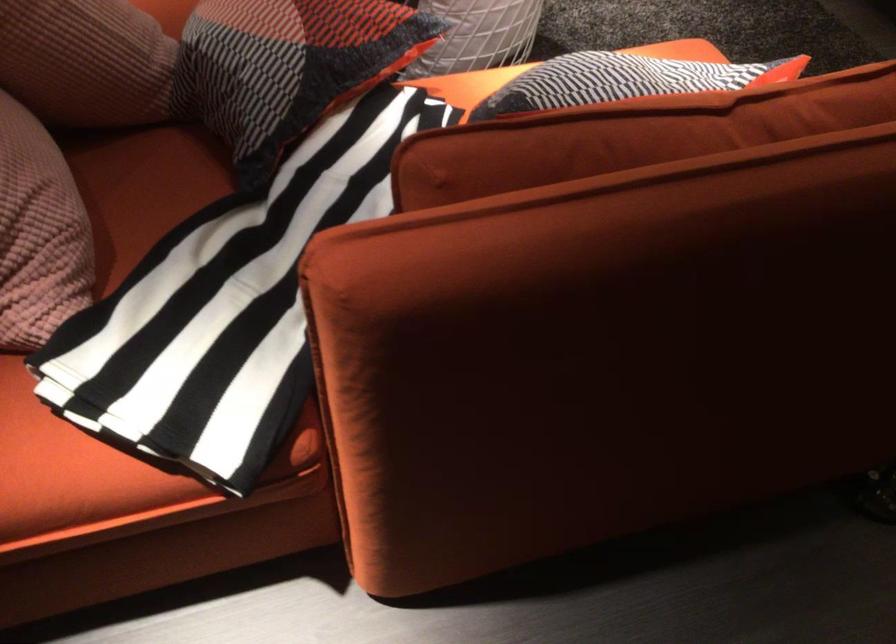
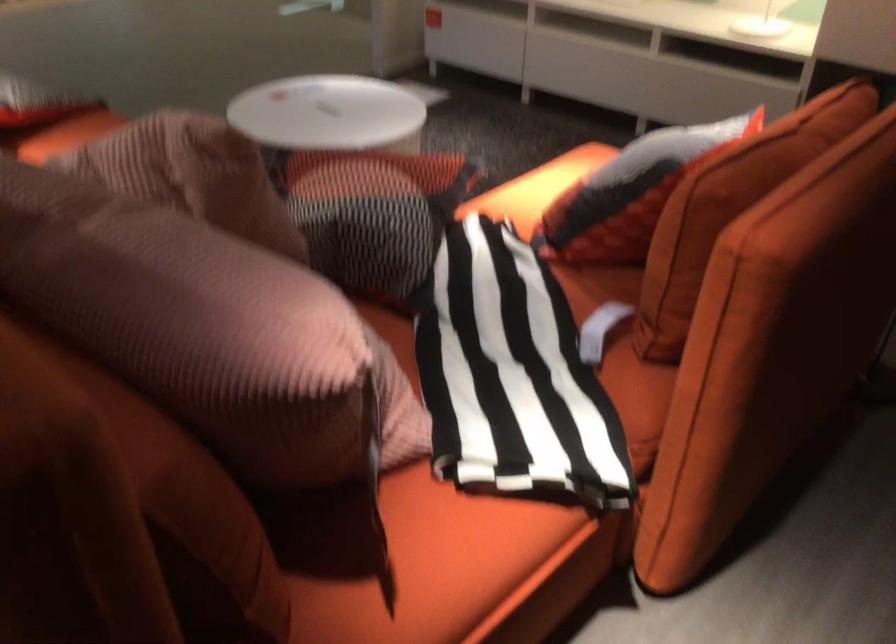
In the second image, find the point that corresponds to pixel 449 203 in the first image.

(730, 207)